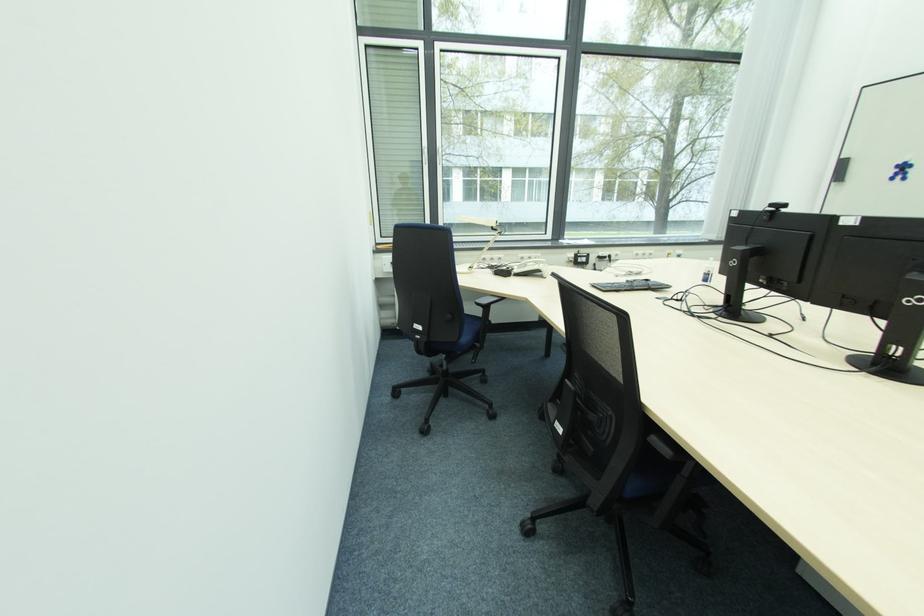
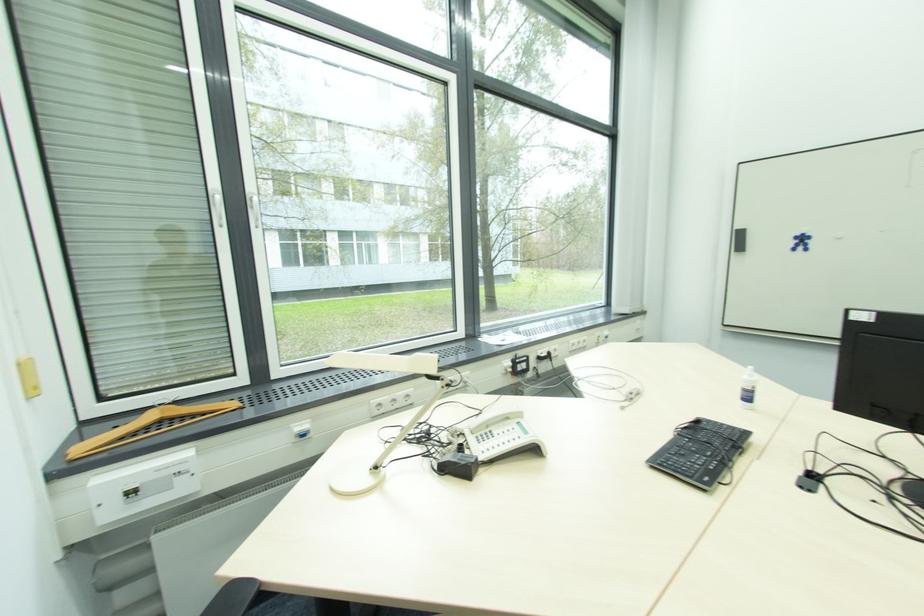
Find the pixel in the second image that matches (650,283) in the first image.

(700, 424)